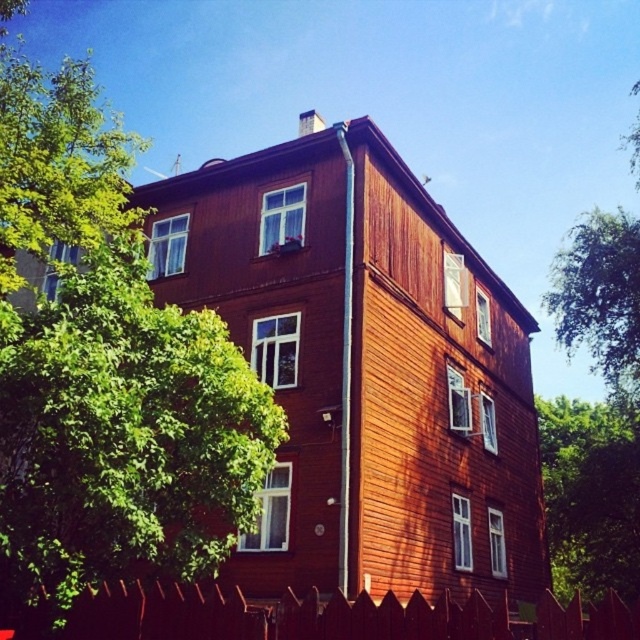
Does smooth wooden fence at lower center appear on the right side of green leafy tree at center?

Incorrect, smooth wooden fence at lower center is not on the right side of green leafy tree at center.

Locate an element on the screen. This screenshot has width=640, height=640. smooth wooden fence at lower center is located at coordinates (x=330, y=616).

Where is `smooth wooden fence at lower center`? Image resolution: width=640 pixels, height=640 pixels. smooth wooden fence at lower center is located at coordinates (330, 616).

I want to click on smooth wooden fence at lower center, so click(x=330, y=616).

Is green leafy tree at upper left to the left of green leafy tree at center from the viewer's perspective?

Correct, you'll find green leafy tree at upper left to the left of green leafy tree at center.

Does green leafy tree at upper left have a smaller size compared to green leafy tree at center?

No.

Find the location of a particular element. The width and height of the screenshot is (640, 640). green leafy tree at upper left is located at coordinates (106, 371).

The width and height of the screenshot is (640, 640). Describe the element at coordinates (106, 371) in the screenshot. I see `green leafy tree at upper left` at that location.

Is green leafy tree at upper left positioned behind smooth wooden fence at lower center?

Yes, green leafy tree at upper left is further from the viewer.

Who is more forward, (48, 488) or (433, 625)?

Point (433, 625) is more forward.

Where is `green leafy tree at upper left`? This screenshot has height=640, width=640. green leafy tree at upper left is located at coordinates (106, 371).